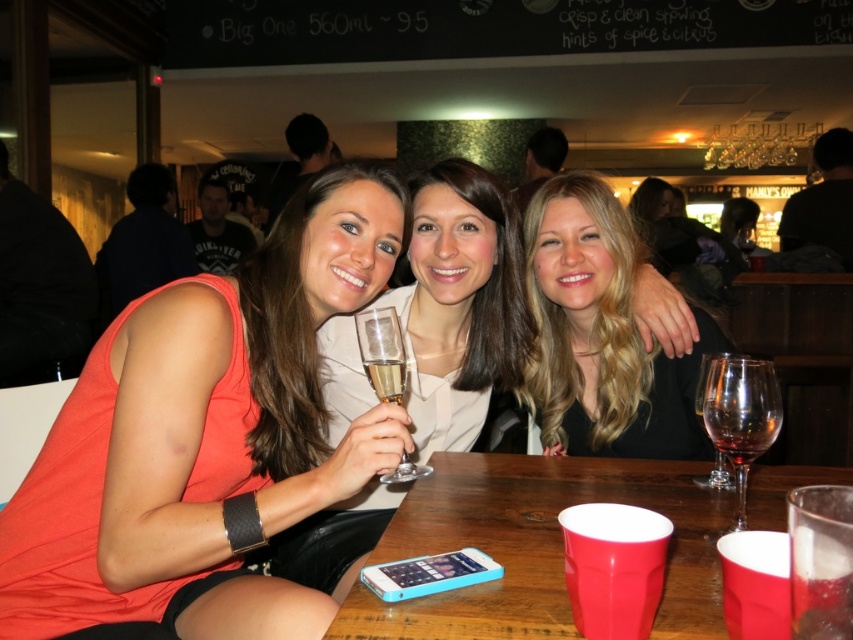
Question: Considering the real-world distances, which object is closest to the matte orange tank top at center?

Choices:
 (A) transparent glass wine glass at right
 (B) matte white dress at center

Answer: (B)

Question: In this image, where is clear glass wine glass at center located relative to transparent glass at table right?

Choices:
 (A) left
 (B) right

Answer: (A)

Question: Among these points, which one is farthest from the camera?

Choices:
 (A) (738, 460)
 (B) (425, 179)
 (C) (561, 412)
 (D) (552, 554)

Answer: (C)

Question: Can you confirm if blonde hair at center is smaller than clear glass wine glass at center?

Choices:
 (A) yes
 (B) no

Answer: (B)

Question: Which of these objects is positioned closest to the clear glass wine glass at center?

Choices:
 (A) transparent glass at table right
 (B) blonde hair at center

Answer: (A)

Question: Is wooden table at center closer to the viewer compared to clear glass wine glass at center?

Choices:
 (A) no
 (B) yes

Answer: (B)